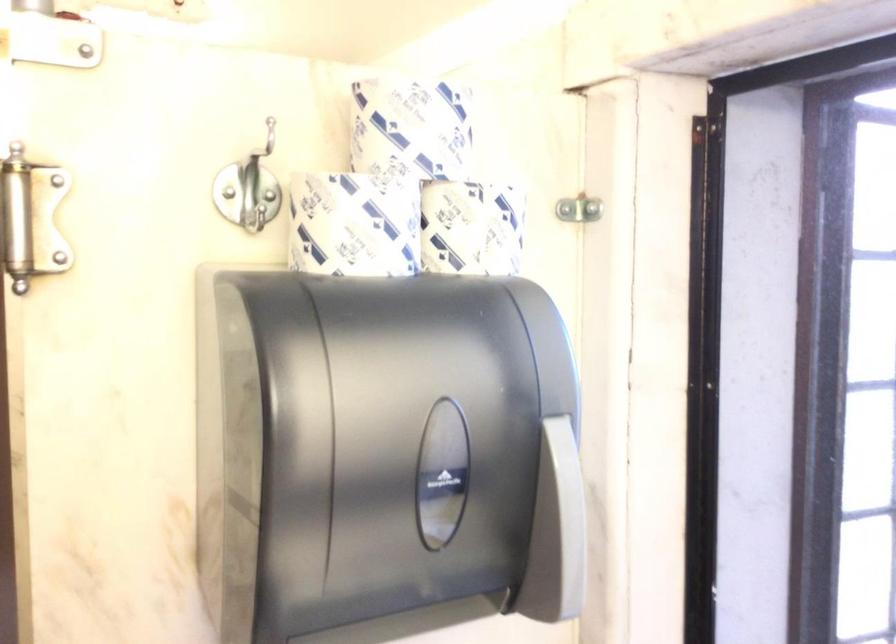
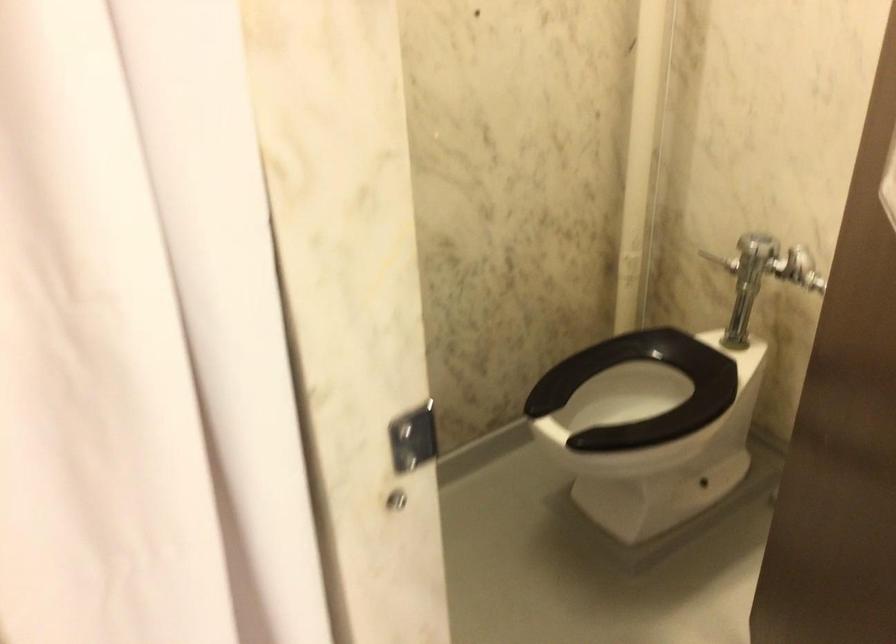
Question: How did the camera likely rotate?

Choices:
 (A) Left
 (B) Right
 (C) Up
 (D) Down

Answer: (D)